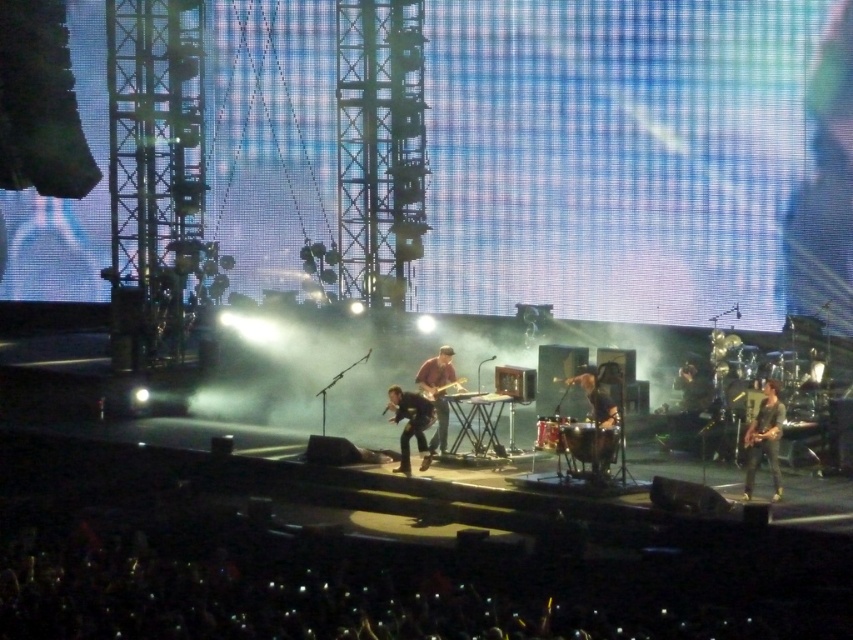
Can you confirm if shiny black guitar at right is shorter than matte brown guitar at center?

Correct, shiny black guitar at right is not as tall as matte brown guitar at center.

Describe the element at coordinates (764, 440) in the screenshot. This screenshot has height=640, width=853. I see `shiny black guitar at right` at that location.

At what (x,y) coordinates should I click in order to perform the action: click on shiny black guitar at right. Please return your answer as a coordinate pair (x, y). Image resolution: width=853 pixels, height=640 pixels. Looking at the image, I should click on point(764,440).

The width and height of the screenshot is (853, 640). I want to click on shiny black guitar at right, so click(764, 440).

Who is more distant from viewer, (773, 387) or (596, 451)?

The point (773, 387) is more distant.

The height and width of the screenshot is (640, 853). In order to click on shiny black guitar at right in this screenshot , I will do `click(764, 440)`.

Is point (439, 397) positioned before point (614, 417)?

That is False.

Between point (445, 371) and point (596, 426), which one is positioned in front?

Point (596, 426)

Identify the location of matte brown guitar at center. Image resolution: width=853 pixels, height=640 pixels. (437, 392).